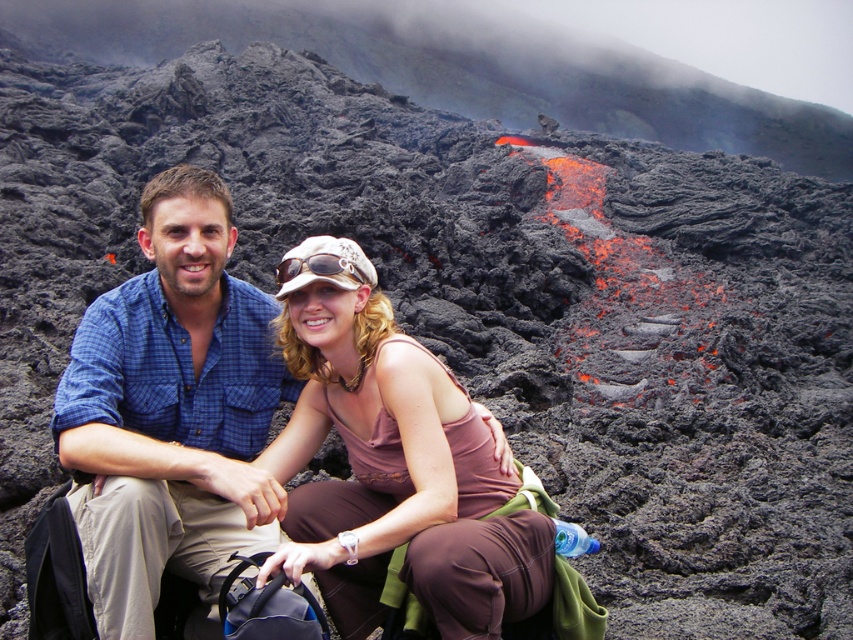
Question: Which point is farther to the camera?

Choices:
 (A) blue plaid shirt at center
 (B) pink fabric at center

Answer: (A)

Question: Can you confirm if blue plaid shirt at center is positioned above pink fabric at center?

Choices:
 (A) no
 (B) yes

Answer: (A)

Question: Does blue plaid shirt at center have a smaller size compared to pink fabric at center?

Choices:
 (A) yes
 (B) no

Answer: (A)

Question: Which object appears closest to the camera in this image?

Choices:
 (A) pink fabric at center
 (B) blue plaid shirt at center

Answer: (A)

Question: Is blue plaid shirt at center above pink fabric at center?

Choices:
 (A) no
 (B) yes

Answer: (A)